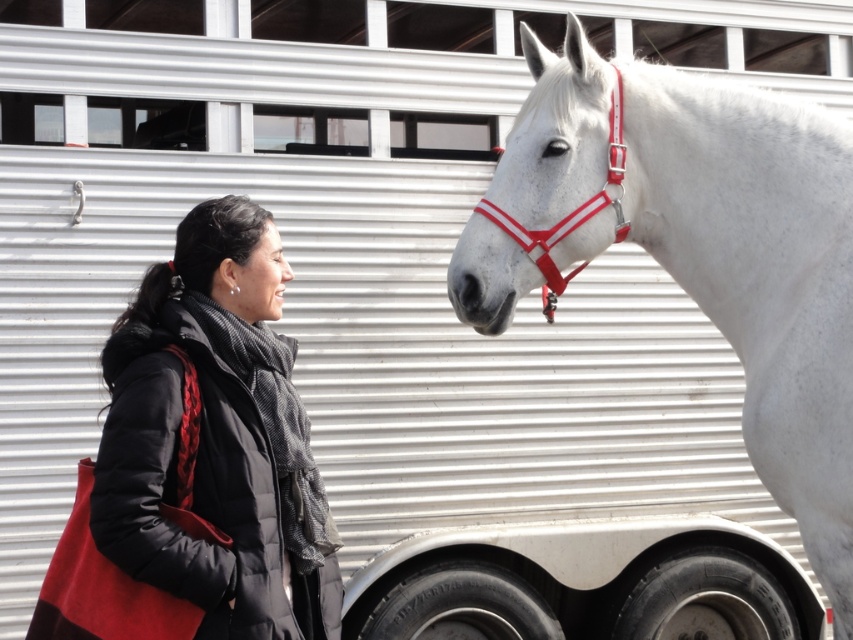
You are a photographer setting up a shot of the woman and the horse. You need to ensure that the black quilted jacket at left and the shiny red plastic bridle at center are both in focus. If your camera has a depth of field that can cover 35 inches, will both objects be in focus?

The black quilted jacket at left and the shiny red plastic bridle at center are 35.20 inches apart. Since the camera can cover 35 inches, the distance between them is slightly beyond the depth of field range. Therefore, both objects might not be fully in focus.

You are a photographer setting up a shot of the white glossy horse at center and the black quilted jacket at left. Which object should you focus on first if you want to capture both in the same frame without moving the camera?

The white glossy horse at center is above the black quilted jacket at left, so you should focus on the white glossy horse at center first to ensure both are in the frame.

You are a photographer trying to capture the white glossy horse at center. Based on its position coordinates, where should you aim your camera to ensure the horse is centered in the photo?

The white glossy horse at center is located at coordinates point (755, 275), so you should aim your camera at that point to center the horse in the photo.